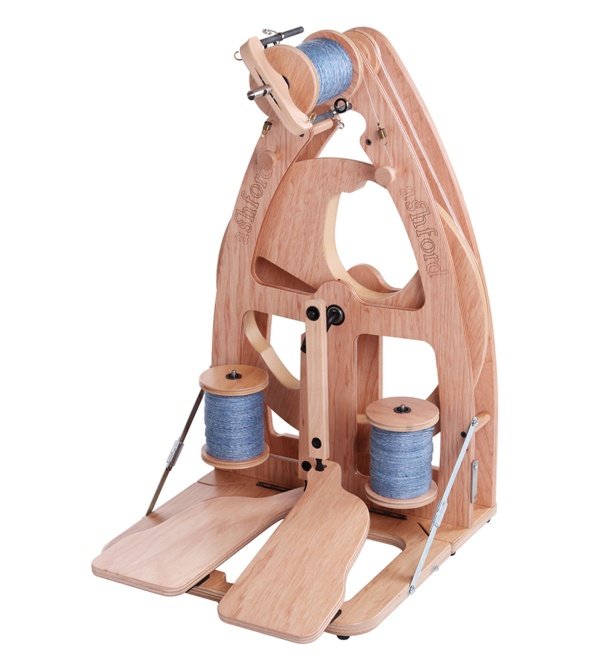
Identify the location of sewing machine. (438, 297).